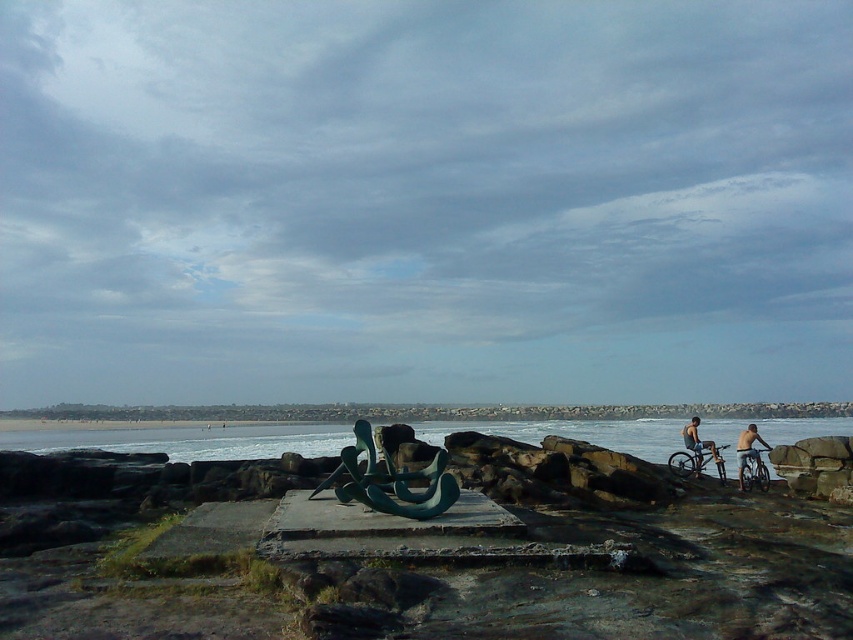
You are a photographer planning to take a wide shot of the coastal scene. You want to ensure that both the metallic silver bicycles at right and the skinny man on bicycle at right are fully visible in the frame. Given their sizes, which object should you prioritize keeping closer to the center of the frame to avoid being cut off?

The metallic silver bicycles at right are wider than the skinny man on bicycle at right. To avoid being cut off, prioritize keeping the metallic silver bicycles at right closer to the center of the frame since it is wider and requires more space.

You are standing on the concrete platform with the sculpture. You see two bicycles, the metallic silver bicycles at right and the shiny metallic bicycle at right. Which one is higher up from the ground?

The metallic silver bicycles at right is located above the shiny metallic bicycle at right, so it is higher up from the ground.